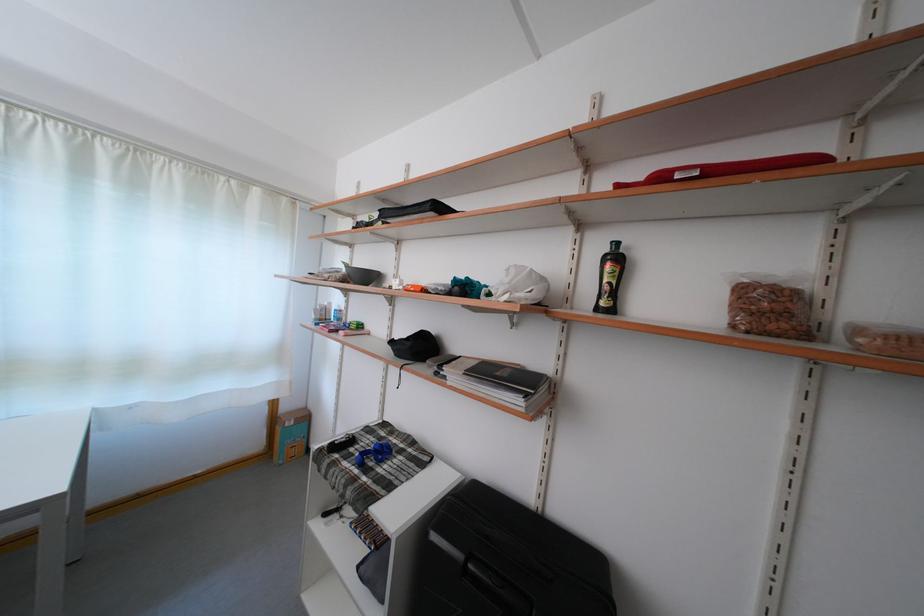
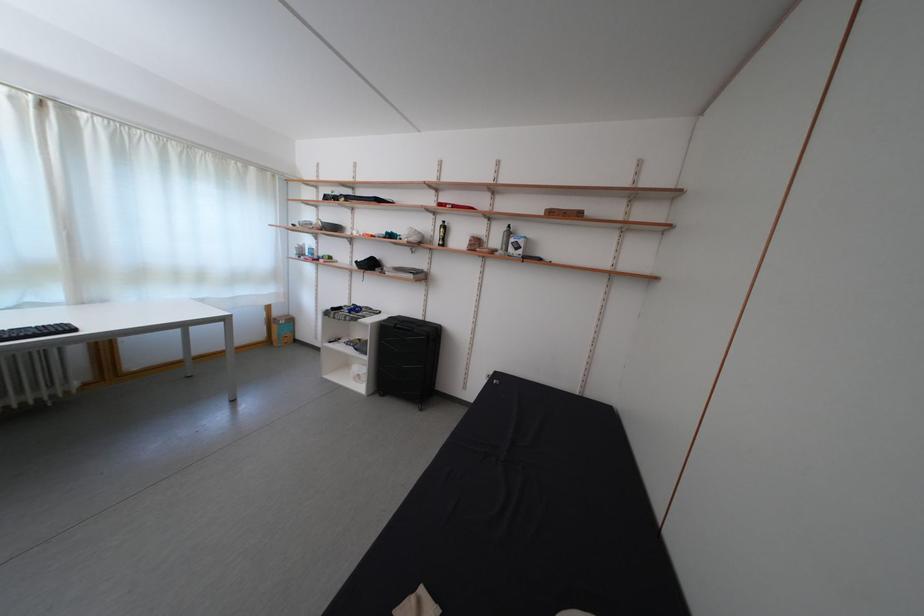
Question: I am providing you with two images of the same scene from different viewpoints. After the viewpoint changes to image2, which objects are now occluded?

Choices:
 (A) green pump bottle
 (B) black suitcase handle
 (C) brown cardboard box
 (D) none of these

Answer: (D)